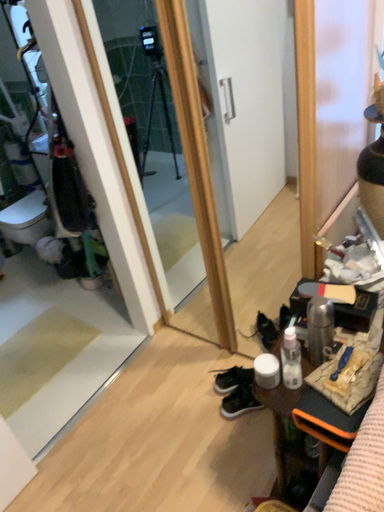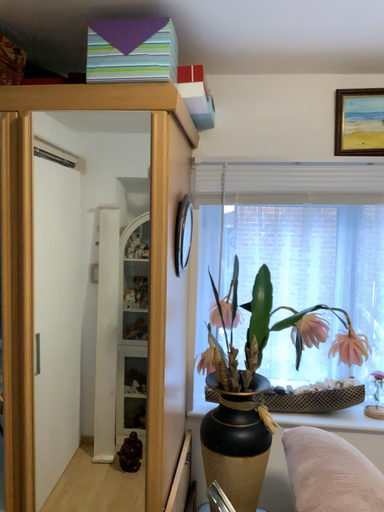
Question: How did the camera likely rotate when shooting the video?

Choices:
 (A) rotated right
 (B) rotated left

Answer: (A)